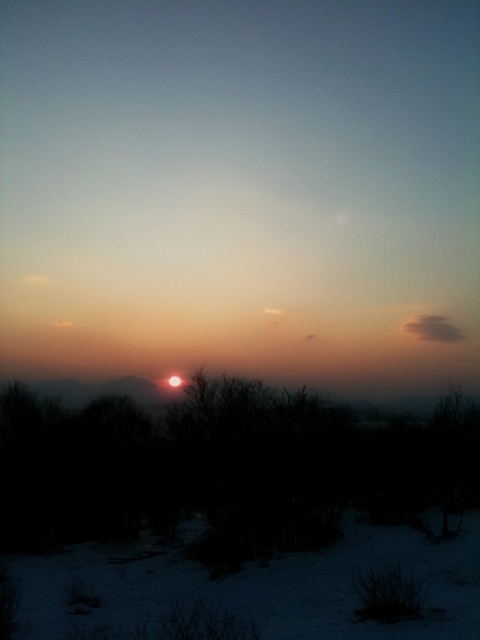
Can you confirm if silhouette leafless tree at center is smaller than white powdery snow at lower center?

Incorrect, silhouette leafless tree at center is not smaller in size than white powdery snow at lower center.

The image size is (480, 640). Describe the element at coordinates (219, 460) in the screenshot. I see `silhouette leafless tree at center` at that location.

Locate an element on the screen. Image resolution: width=480 pixels, height=640 pixels. silhouette leafless tree at center is located at coordinates (x=219, y=460).